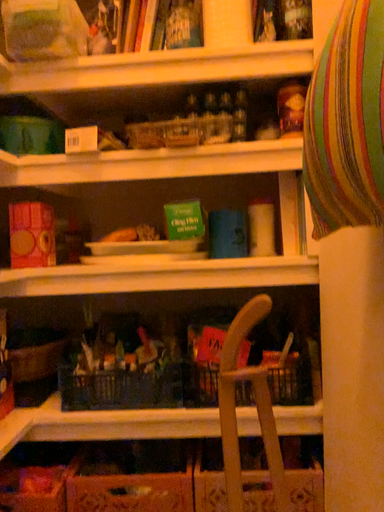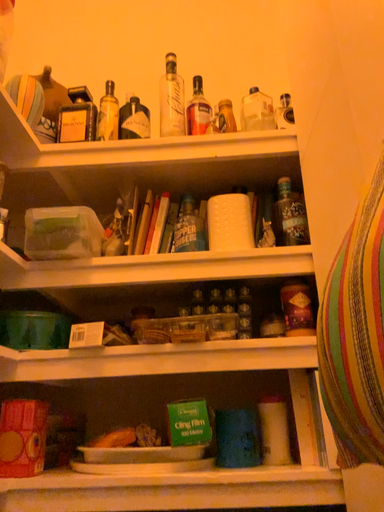
Question: How did the camera likely rotate when shooting the video?

Choices:
 (A) rotated downward
 (B) rotated upward

Answer: (B)